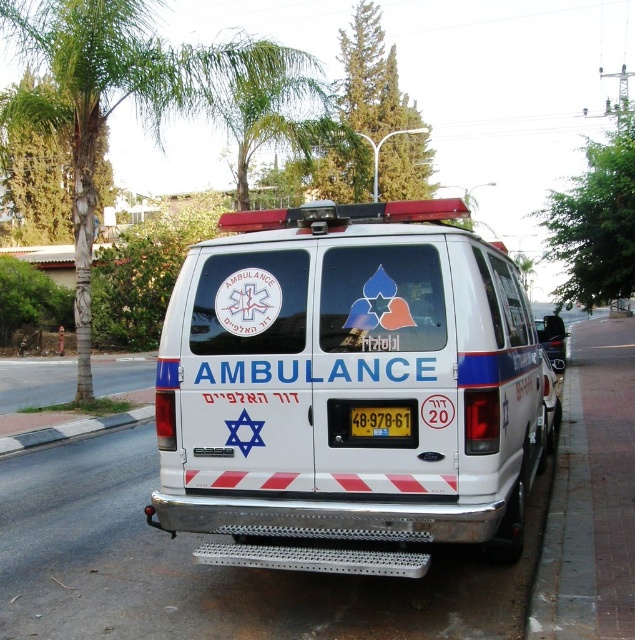
You are a delivery driver who needs to park your truck in the parking spot behind the white glossy ambulance at center. The parking spot is marked by the gray concrete curb at lower left. Your truck requires a minimum of 20 feet of space to safely back into the spot. Can you safely park your truck there?

The distance between the white glossy ambulance at center and the gray concrete curb at lower left is 24.04 feet, which is more than the required 20 feet. Therefore, you can safely park your truck there.

You are standing 10 feet away from the ambulance. Is the point at coordinate point at point (378,413) on the ambulance closer to you than the license plate?

The distance of point (378,413) from viewer is 13.61 feet, so the point is farther away than the license plate which is 10 feet away. Therefore, the license plate is closer to you.